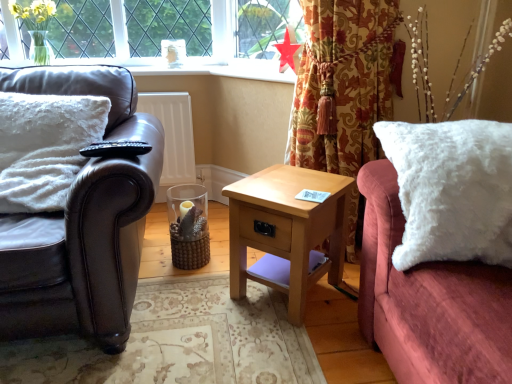
What do you see at coordinates (342, 84) in the screenshot? I see `floral fabric curtain at upper right` at bounding box center [342, 84].

At what (x,y) coordinates should I click in order to perform the action: click on red paper star at upper center. Please return your answer as a coordinate pair (x, y). The width and height of the screenshot is (512, 384). Looking at the image, I should click on point(289,51).

Locate an element on the screen. white fluffy pillow at right is located at coordinates (429, 301).

The image size is (512, 384). Find the location of `floral fabric curtain at upper right`. floral fabric curtain at upper right is located at coordinates (342, 84).

From a real-world perspective, is white fluffy pillow at left positioned under leather couch at left based on gravity?

Actually, white fluffy pillow at left is physically above leather couch at left in the real world.

Is white fluffy pillow at left not close to leather couch at left?

They are positioned close to each other.

Would you say white fluffy pillow at left is inside or outside leather couch at left?

white fluffy pillow at left lies within the bounds of leather couch at left.

Who is shorter, white fluffy pillow at left or leather couch at left?

white fluffy pillow at left.

Which of these two, floral fabric curtain at upper right or white fluffy pillow at left, is bigger?

floral fabric curtain at upper right is bigger.

Considering the sizes of floral fabric curtain at upper right and white fluffy pillow at left in the image, is floral fabric curtain at upper right wider or thinner than white fluffy pillow at left?

In the image, floral fabric curtain at upper right appears to be wider than white fluffy pillow at left.

Is floral fabric curtain at upper right aimed at white fluffy pillow at left?

No, floral fabric curtain at upper right is not turned towards white fluffy pillow at left.

Which is correct: floral fabric curtain at upper right is inside white fluffy pillow at left, or outside of it?

floral fabric curtain at upper right is located beyond the bounds of white fluffy pillow at left.

From a real-world perspective, is leather couch at left positioned above or below red paper star at upper center?

leather couch at left is situated lower than red paper star at upper center in the real world.

Is leather couch at left smaller than red paper star at upper center?

No, leather couch at left is not smaller than red paper star at upper center.

Is leather couch at left not near red paper star at upper center?

Yes, leather couch at left and red paper star at upper center are located far from each other.

Can you confirm if leather couch at left is wider than red paper star at upper center?

Yes.

Based on the photo, is white fluffy pillow at right not within light wood/texture nightstand at center?

Indeed, white fluffy pillow at right is completely outside light wood/texture nightstand at center.

Find the location of a particular element. couch located above the light wood/texture nightstand at center (from the image's perspective) is located at coordinates (429, 301).

Consider the image. Is white fluffy pillow at right oriented away from light wood/texture nightstand at center?

No, white fluffy pillow at right is not facing the opposite direction of light wood/texture nightstand at center.

Is point (485, 287) closer to camera compared to point (234, 196)?

That is True.

Does leather couch at left turn towards light wood/texture nightstand at center?

No, leather couch at left does not turn towards light wood/texture nightstand at center.

How many degrees apart are the facing directions of leather couch at left and light wood/texture nightstand at center?

leather couch at left and light wood/texture nightstand at center are facing 44.5 degrees away from each other.

From the image's perspective, which object appears higher, leather couch at left or light wood/texture nightstand at center?

leather couch at left.

Which is more to the right, leather couch at left or light wood/texture nightstand at center?

Positioned to the right is light wood/texture nightstand at center.

What's the angular difference between white fluffy pillow at right and white fluffy pillow at left's facing directions?

9.05 degrees.

Considering the sizes of objects white fluffy pillow at right and white fluffy pillow at left in the image provided, who is shorter, white fluffy pillow at right or white fluffy pillow at left?

white fluffy pillow at left is shorter.

Is white fluffy pillow at left completely or partially inside white fluffy pillow at right?

No.

Can you see light wood/texture nightstand at center touching red paper star at upper center?

No.

Who is more distant, light wood/texture nightstand at center or red paper star at upper center?

red paper star at upper center.

Considering the relative sizes of light wood/texture nightstand at center and red paper star at upper center in the image provided, is light wood/texture nightstand at center shorter than red paper star at upper center?

No.

The width and height of the screenshot is (512, 384). I want to click on flower positioned vertically above the light wood/texture nightstand at center (from a real-world perspective), so click(x=289, y=51).

Find the location of `pillow lying on the left of leather couch at left`. pillow lying on the left of leather couch at left is located at coordinates (45, 147).

At what (x,y) coordinates should I click in order to perform the action: click on curtain behind the white fluffy pillow at left. Please return your answer as a coordinate pair (x, y). This screenshot has height=384, width=512. Looking at the image, I should click on (342, 84).

Looking at this image, based on their spatial positions, is leather couch at left or red paper star at upper center closer to white fluffy pillow at right?

leather couch at left is positioned closer to the anchor white fluffy pillow at right.

Estimate the real-world distances between objects in this image. Which object is further from floral fabric curtain at upper right, white fluffy pillow at right or white fluffy pillow at left?

white fluffy pillow at left.

Which object lies nearer to the anchor point leather couch at left, floral fabric curtain at upper right or white fluffy pillow at left?

white fluffy pillow at left lies closer to leather couch at left than the other object.

Looking at the image, which one is located closer to red paper star at upper center, floral fabric curtain at upper right or white fluffy pillow at left?

floral fabric curtain at upper right.

When comparing their distances from white fluffy pillow at right, does leather couch at left or white fluffy pillow at left seem further?

white fluffy pillow at left lies further to white fluffy pillow at right than the other object.

Based on their spatial positions, is leather couch at left or floral fabric curtain at upper right closer to red paper star at upper center?

Based on the image, floral fabric curtain at upper right appears to be nearer to red paper star at upper center.

From the image, which object appears to be nearer to white fluffy pillow at right, floral fabric curtain at upper right or light wood/texture nightstand at center?

light wood/texture nightstand at center is positioned closer to the anchor white fluffy pillow at right.

Based on their spatial positions, is white fluffy pillow at right or floral fabric curtain at upper right closer to red paper star at upper center?

floral fabric curtain at upper right lies closer to red paper star at upper center than the other object.

The image size is (512, 384). Find the location of `curtain between red paper star at upper center and light wood/texture nightstand at center vertically`. curtain between red paper star at upper center and light wood/texture nightstand at center vertically is located at coordinates (342, 84).

Locate an element on the screen. This screenshot has height=384, width=512. nightstand located between leather couch at left and red paper star at upper center in the left-right direction is located at coordinates (287, 232).

The width and height of the screenshot is (512, 384). In order to click on curtain between leather couch at left and white fluffy pillow at right from left to right in this screenshot , I will do `click(342, 84)`.

The image size is (512, 384). In order to click on flower located between white fluffy pillow at left and floral fabric curtain at upper right in the left-right direction in this screenshot , I will do `click(289, 51)`.